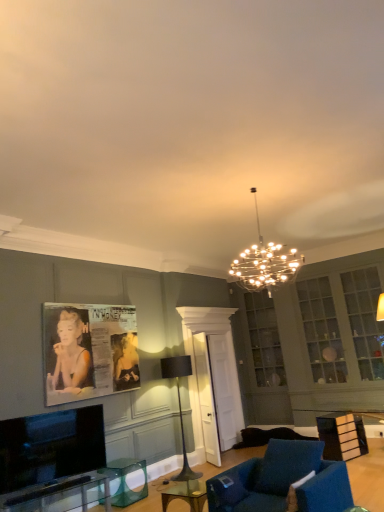
Question: Considering the relative sizes of metallic chandelier at center, the 1th lamp from the front, and black glossy poster at left in the image provided, is metallic chandelier at center, the 1th lamp from the front, thinner than black glossy poster at left?

Choices:
 (A) no
 (B) yes

Answer: (A)

Question: Does metallic chandelier at center, which is counted as the second lamp, starting from the left, come behind black glossy poster at left?

Choices:
 (A) yes
 (B) no

Answer: (B)

Question: From the image's perspective, is metallic chandelier at center, placed as the 1th lamp when sorted from right to left, below black glossy poster at left?

Choices:
 (A) yes
 (B) no

Answer: (B)

Question: From a real-world perspective, is metallic chandelier at center, placed as the 1th lamp when sorted from right to left, under black glossy poster at left?

Choices:
 (A) no
 (B) yes

Answer: (A)

Question: Can you confirm if metallic chandelier at center, placed as the 1th lamp when sorted from right to left, is bigger than black glossy poster at left?

Choices:
 (A) no
 (B) yes

Answer: (B)

Question: Considering the relative sizes of clear glass table at center, the second round table when ordered from back to front, and transparent glass door at center in the image provided, is clear glass table at center, the second round table when ordered from back to front, thinner than transparent glass door at center?

Choices:
 (A) no
 (B) yes

Answer: (A)

Question: From a real-world perspective, is clear glass table at center, positioned as the 1th round table in front-to-back order, positioned over transparent glass door at center based on gravity?

Choices:
 (A) yes
 (B) no

Answer: (B)

Question: Can you confirm if clear glass table at center, which is the first round table in top-to-bottom order, is bigger than transparent glass door at center?

Choices:
 (A) no
 (B) yes

Answer: (A)

Question: Is clear glass table at center, positioned as the 1th round table in front-to-back order, to the right of transparent glass door at center from the viewer's perspective?

Choices:
 (A) yes
 (B) no

Answer: (B)

Question: Can you confirm if clear glass table at center, placed as the 1th round table when sorted from right to left, is wider than transparent glass door at center?

Choices:
 (A) no
 (B) yes

Answer: (B)

Question: From the image's perspective, does clear glass table at center, positioned as the 1th round table in front-to-back order, appear lower than transparent glass door at center?

Choices:
 (A) no
 (B) yes

Answer: (B)

Question: From a real-world perspective, is metallic chandelier at center, the 1th lamp from the front, below transparent glass table at lower center, marked as the first round table in a left-to-right arrangement?

Choices:
 (A) no
 (B) yes

Answer: (A)